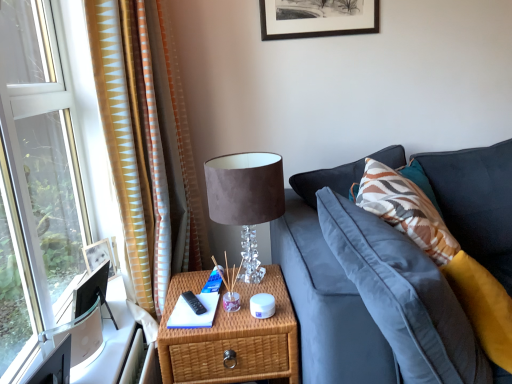
Question: From a real-world perspective, is gold-patterned fabric curtain at left physically above velvet lampshade at upper center?

Choices:
 (A) yes
 (B) no

Answer: (A)

Question: Is the surface of gold-patterned fabric curtain at left in direct contact with velvet lampshade at upper center?

Choices:
 (A) yes
 (B) no

Answer: (B)

Question: Is gold-patterned fabric curtain at left shorter than velvet lampshade at upper center?

Choices:
 (A) no
 (B) yes

Answer: (A)

Question: Can you confirm if gold-patterned fabric curtain at left is taller than velvet lampshade at upper center?

Choices:
 (A) yes
 (B) no

Answer: (A)

Question: Is the depth of gold-patterned fabric curtain at left greater than that of velvet lampshade at upper center?

Choices:
 (A) yes
 (B) no

Answer: (B)

Question: Looking at their shapes, would you say woven wood nightstand at center is wider or thinner than velvet lampshade at upper center?

Choices:
 (A) thin
 (B) wide

Answer: (B)

Question: Is point (267, 340) positioned closer to the camera than point (254, 220)?

Choices:
 (A) farther
 (B) closer

Answer: (B)

Question: Considering their positions, is woven wood nightstand at center located in front of or behind velvet lampshade at upper center?

Choices:
 (A) behind
 (B) front

Answer: (B)

Question: Is woven wood nightstand at center spatially inside velvet lampshade at upper center, or outside of it?

Choices:
 (A) inside
 (B) outside

Answer: (B)

Question: Does point (283, 331) appear closer or farther from the camera than point (196, 213)?

Choices:
 (A) farther
 (B) closer

Answer: (B)

Question: From the image's perspective, is woven wood nightstand at center above or below gold-patterned fabric curtain at left?

Choices:
 (A) below
 (B) above

Answer: (A)

Question: Relative to gold-patterned fabric curtain at left, is woven wood nightstand at center in front or behind?

Choices:
 (A) front
 (B) behind

Answer: (A)

Question: From a real-world perspective, is woven wood nightstand at center above or below gold-patterned fabric curtain at left?

Choices:
 (A) below
 (B) above

Answer: (A)

Question: From the image's perspective, relative to woven wood nightstand at center, is velvet lampshade at upper center above or below?

Choices:
 (A) above
 (B) below

Answer: (A)

Question: Considering the positions of velvet lampshade at upper center and woven wood nightstand at center in the image, is velvet lampshade at upper center taller or shorter than woven wood nightstand at center?

Choices:
 (A) tall
 (B) short

Answer: (B)